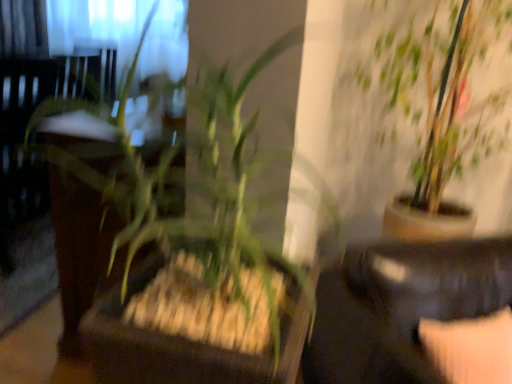
Question: Relative to green leafy plant at upper right, acting as the first houseplant starting from the right, is velvet beige pillow at lower right in front or behind?

Choices:
 (A) behind
 (B) front

Answer: (B)

Question: Would you say velvet beige pillow at lower right is to the left or to the right of green leafy plant at upper right, the second houseplant in the front-to-back sequence, in the picture?

Choices:
 (A) right
 (B) left

Answer: (B)

Question: Estimate the real-world distances between objects in this image. Which object is closer to the black leather couch at lower right?

Choices:
 (A) velvet beige pillow at lower right
 (B) green leafy plant at center, the 2th houseplant viewed from the right
 (C) green leafy plant at upper right, the 1th houseplant positioned from the back

Answer: (A)

Question: Estimate the real-world distances between objects in this image. Which object is farther from the green leafy plant at center, positioned as the 1th houseplant in left-to-right order?

Choices:
 (A) green leafy plant at upper right, the second houseplant in the front-to-back sequence
 (B) black leather couch at lower right
 (C) velvet beige pillow at lower right

Answer: (A)